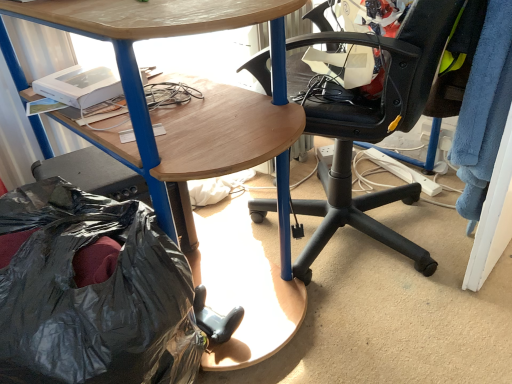
Question: From the image's perspective, is wooden desk at center beneath black plastic bag at lower left?

Choices:
 (A) yes
 (B) no

Answer: (B)

Question: Is there a large distance between wooden desk at center and black plastic bag at lower left?

Choices:
 (A) yes
 (B) no

Answer: (B)

Question: Can you confirm if wooden desk at center is taller than black plastic bag at lower left?

Choices:
 (A) yes
 (B) no

Answer: (A)

Question: Considering the relative sizes of wooden desk at center and black plastic bag at lower left in the image provided, is wooden desk at center wider than black plastic bag at lower left?

Choices:
 (A) no
 (B) yes

Answer: (B)

Question: Is wooden desk at center behind black plastic bag at lower left?

Choices:
 (A) no
 (B) yes

Answer: (B)

Question: Considering the positions of black plastic chair at center and wooden desk at center in the image, is black plastic chair at center taller or shorter than wooden desk at center?

Choices:
 (A) short
 (B) tall

Answer: (A)

Question: Is black plastic chair at center inside or outside of wooden desk at center?

Choices:
 (A) inside
 (B) outside

Answer: (A)

Question: Considering the positions of black plastic chair at center and wooden desk at center in the image, is black plastic chair at center wider or thinner than wooden desk at center?

Choices:
 (A) wide
 (B) thin

Answer: (B)

Question: Based on their sizes in the image, would you say black plastic chair at center is bigger or smaller than wooden desk at center?

Choices:
 (A) big
 (B) small

Answer: (B)

Question: Does point (2, 269) appear closer or farther from the camera than point (233, 278)?

Choices:
 (A) closer
 (B) farther

Answer: (A)

Question: Considering the positions of black plastic bag at lower left and wooden desk at center in the image, is black plastic bag at lower left bigger or smaller than wooden desk at center?

Choices:
 (A) small
 (B) big

Answer: (A)

Question: Is black plastic bag at lower left to the left or to the right of wooden desk at center in the image?

Choices:
 (A) left
 (B) right

Answer: (A)

Question: From the image's perspective, is black plastic bag at lower left positioned above or below wooden desk at center?

Choices:
 (A) below
 (B) above

Answer: (A)

Question: Do you think wooden desk at center is within black plastic bag at lower left, or outside of it?

Choices:
 (A) inside
 (B) outside

Answer: (B)

Question: From a real-world perspective, is wooden desk at center above or below black plastic bag at lower left?

Choices:
 (A) below
 (B) above

Answer: (B)